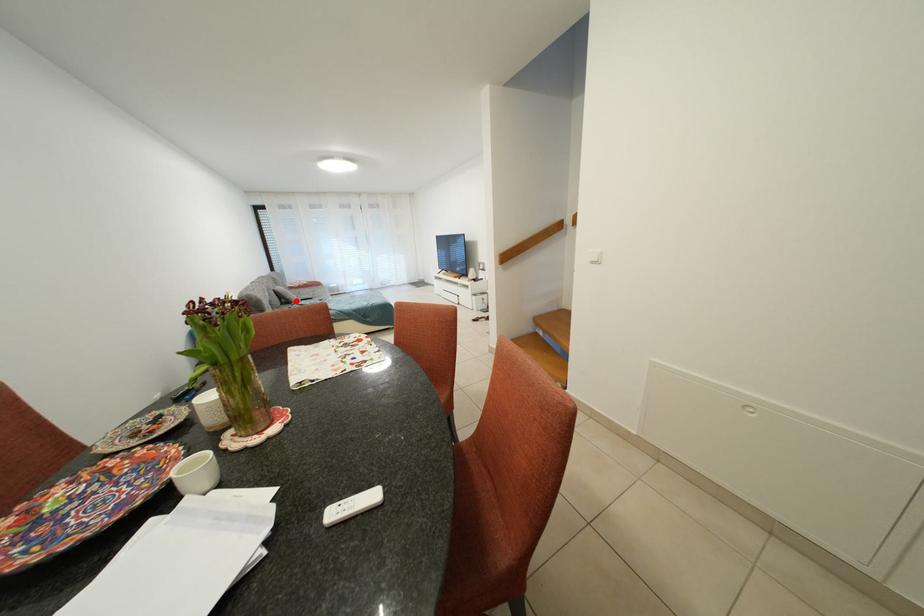
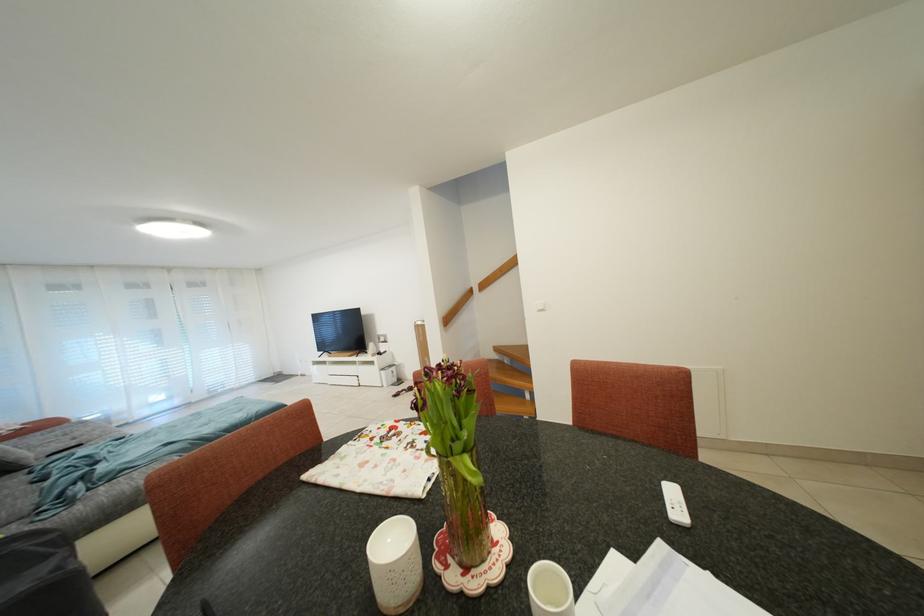
Find the pixel in the second image that matches the highlighted location in the first image.

(19, 462)